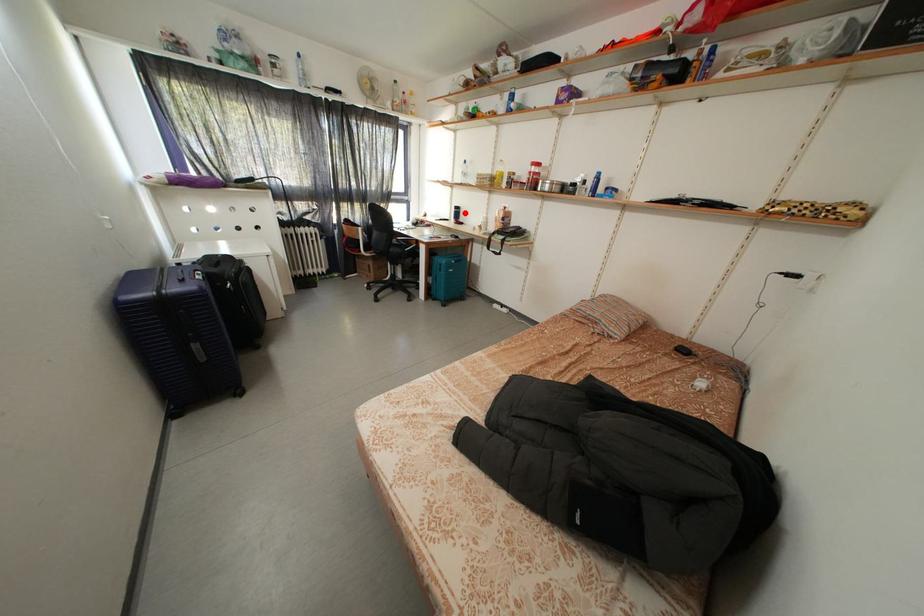
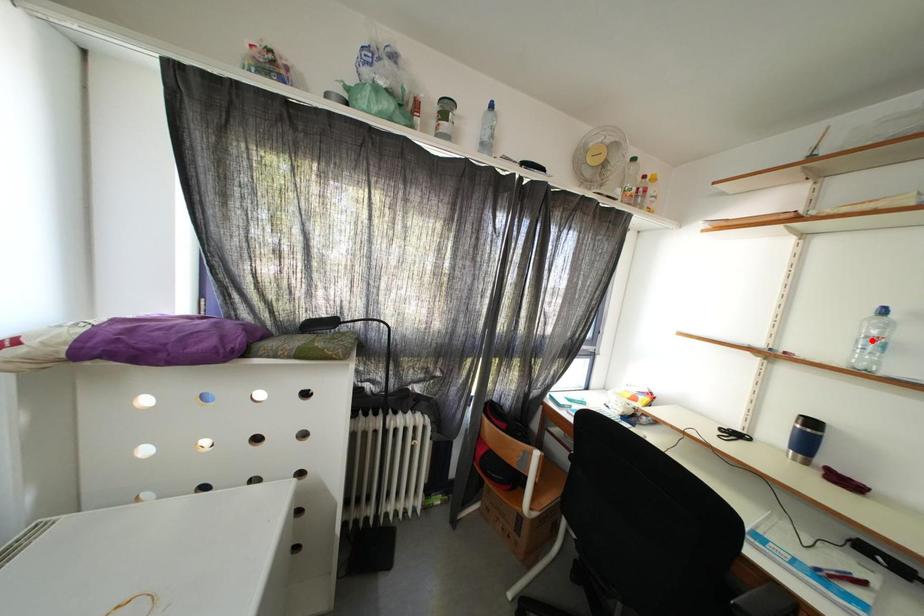
I am providing you with two images of the same scene from different viewpoints. A red point is marked on the first image and another point is marked on the second image. Is the marked point in image1 the same physical position as the marked point in image2?

No